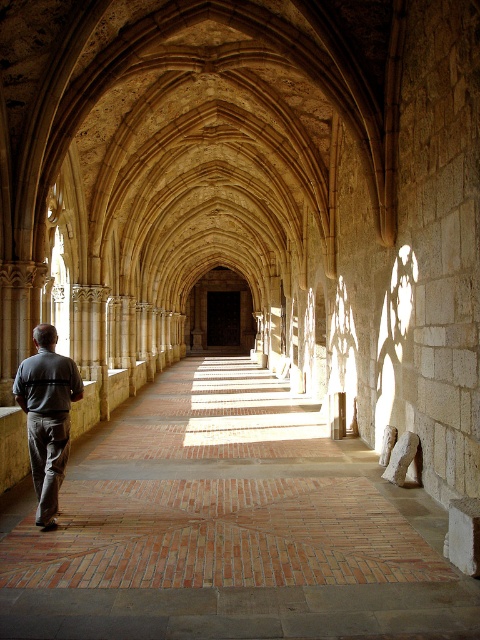
Question: Which point is farther to the camera?

Choices:
 (A) brick at center
 (B) gray cotton pants at center

Answer: (B)

Question: Can you confirm if brick at center is positioned below gray cotton pants at center?

Choices:
 (A) no
 (B) yes

Answer: (B)

Question: Which object appears farthest from the camera in this image?

Choices:
 (A) brick at center
 (B) gray cotton pants at center

Answer: (B)

Question: Can you confirm if brick at center is positioned above gray cotton pants at center?

Choices:
 (A) yes
 (B) no

Answer: (B)

Question: Is brick at center to the right of gray cotton pants at center from the viewer's perspective?

Choices:
 (A) no
 (B) yes

Answer: (B)

Question: Which point is farther to the camera?

Choices:
 (A) brick at center
 (B) gray cotton pants at center

Answer: (B)